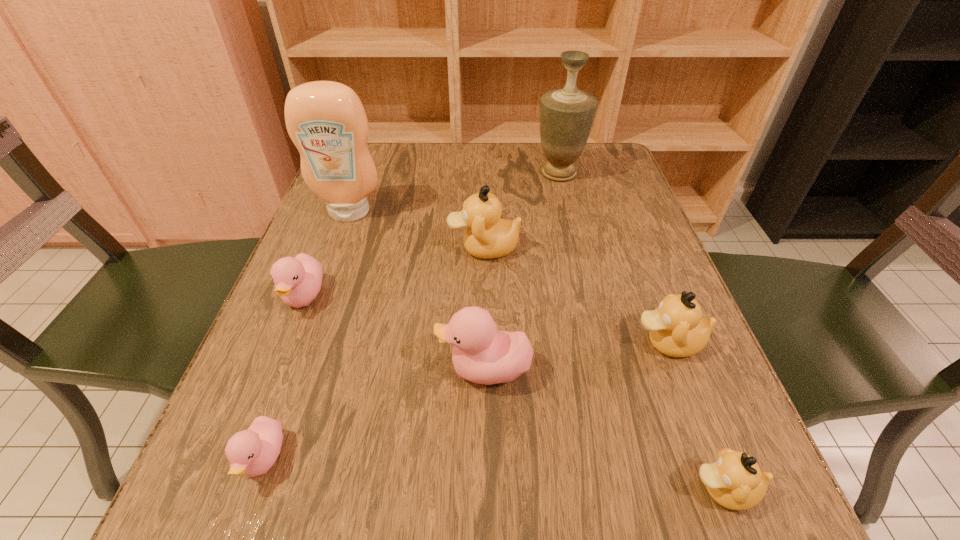
Where is `free spot between the second farthest object and the nearest tan duckling`? The width and height of the screenshot is (960, 540). free spot between the second farthest object and the nearest tan duckling is located at coordinates coord(537,351).

Image resolution: width=960 pixels, height=540 pixels. I want to click on free space between the second farthest object and the farthest object, so click(454, 193).

The image size is (960, 540). I want to click on vacant space that's between the sixth nearest object and the urn, so click(x=521, y=211).

I want to click on free space that is in between the second farthest pink duckling and the leftmost tan duckling, so click(484, 309).

At what (x,y) coordinates should I click in order to perform the action: click on free space between the second biggest tan duckling and the farthest object. Please return your answer as a coordinate pair (x, y). Looking at the image, I should click on (613, 258).

Identify the location of unoccupied area between the smallest pink duckling and the second farthest tan duckling. This screenshot has height=540, width=960. (467, 401).

The height and width of the screenshot is (540, 960). I want to click on free area in between the smallest pink duckling and the second farthest object, so (306, 336).

Find the location of a particular element. The height and width of the screenshot is (540, 960). unoccupied area between the second nearest tan duckling and the urn is located at coordinates (613, 258).

Locate an element on the screen. the seventh closest object relative to the biggest pink duckling is located at coordinates (566, 115).

Choose which object is the second nearest neighbor to the shortest object. Please provide its 2D coordinates. Your answer should be formatted as a tuple, i.e. [(x, y)], where the tuple contains the x and y coordinates of a point satisfying the conditions above.

[(482, 354)]